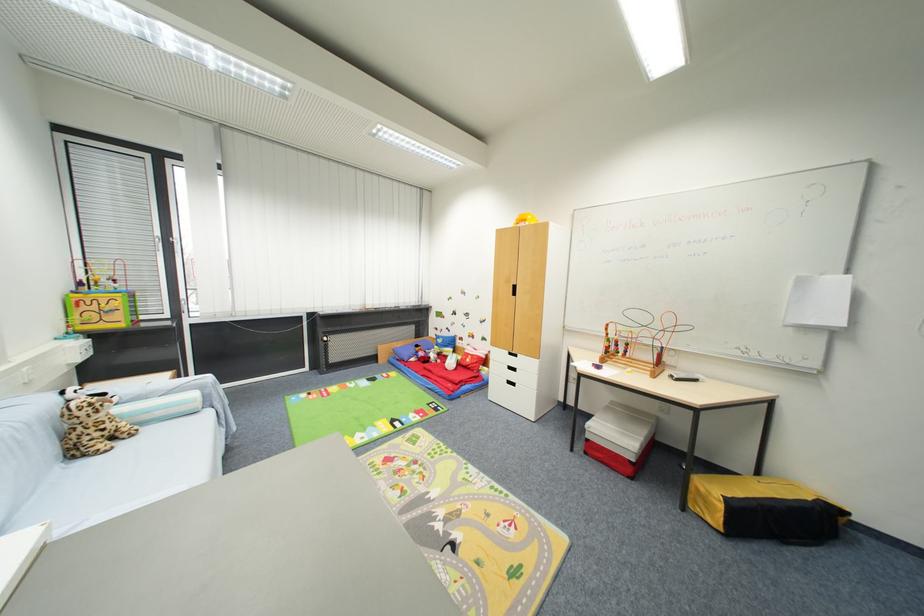
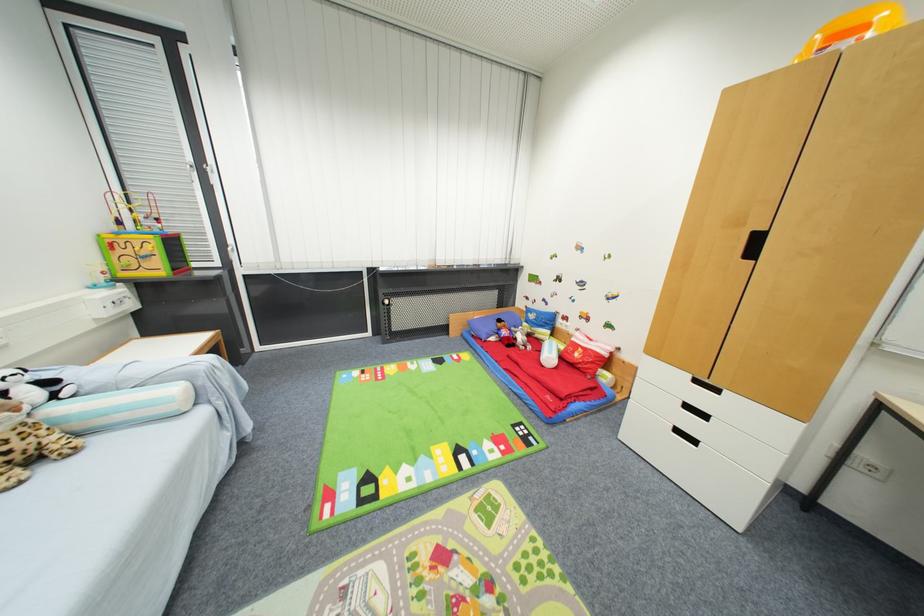
The point at [408,422] is marked in the first image. Where is the corresponding point in the second image?

(479, 455)